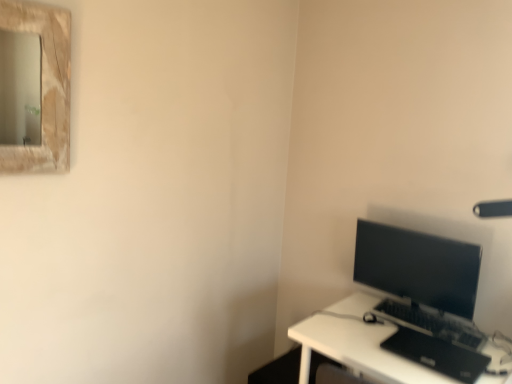
Question: Can you confirm if white plastic desk at lower right is bigger than black matte laptop at lower right?

Choices:
 (A) yes
 (B) no

Answer: (A)

Question: Considering the relative sizes of white plastic desk at lower right and black matte laptop at lower right in the image provided, is white plastic desk at lower right wider than black matte laptop at lower right?

Choices:
 (A) no
 (B) yes

Answer: (B)

Question: From a real-world perspective, is white plastic desk at lower right under black matte laptop at lower right?

Choices:
 (A) no
 (B) yes

Answer: (B)

Question: Would you say white plastic desk at lower right is outside black matte laptop at lower right?

Choices:
 (A) yes
 (B) no

Answer: (A)

Question: Is white plastic desk at lower right smaller than black matte laptop at lower right?

Choices:
 (A) yes
 (B) no

Answer: (B)

Question: Is white plastic desk at lower right to the right of black matte laptop at lower right from the viewer's perspective?

Choices:
 (A) no
 (B) yes

Answer: (A)

Question: Does black plastic keyboard at lower right have a greater width compared to white plastic desk at lower right?

Choices:
 (A) no
 (B) yes

Answer: (A)

Question: From the image's perspective, is black plastic keyboard at lower right under white plastic desk at lower right?

Choices:
 (A) no
 (B) yes

Answer: (A)

Question: Would you say black plastic keyboard at lower right is a long distance from white plastic desk at lower right?

Choices:
 (A) no
 (B) yes

Answer: (A)

Question: Is black plastic keyboard at lower right facing away from white plastic desk at lower right?

Choices:
 (A) yes
 (B) no

Answer: (B)

Question: Is black plastic keyboard at lower right smaller than white plastic desk at lower right?

Choices:
 (A) no
 (B) yes

Answer: (B)

Question: Can you confirm if black plastic keyboard at lower right is positioned to the left of white plastic desk at lower right?

Choices:
 (A) yes
 (B) no

Answer: (B)

Question: Does black matte laptop at lower right appear on the right side of matte black monitor at right?

Choices:
 (A) yes
 (B) no

Answer: (A)